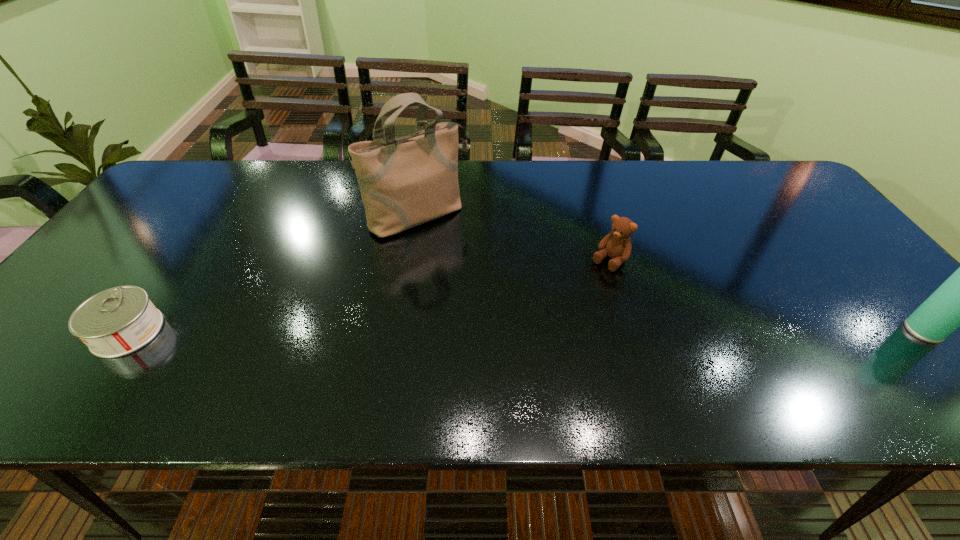
Locate an element on the screen. The height and width of the screenshot is (540, 960). free spot on the desktop that is between the can and the thermos bottle and is positioned on the face of the second object from right to left is located at coordinates (x=540, y=331).

Locate an element on the screen. The width and height of the screenshot is (960, 540). vacant spot on the desktop that is between the can and the second tallest object and is positioned on the front-facing side of the shoulder bag is located at coordinates (530, 331).